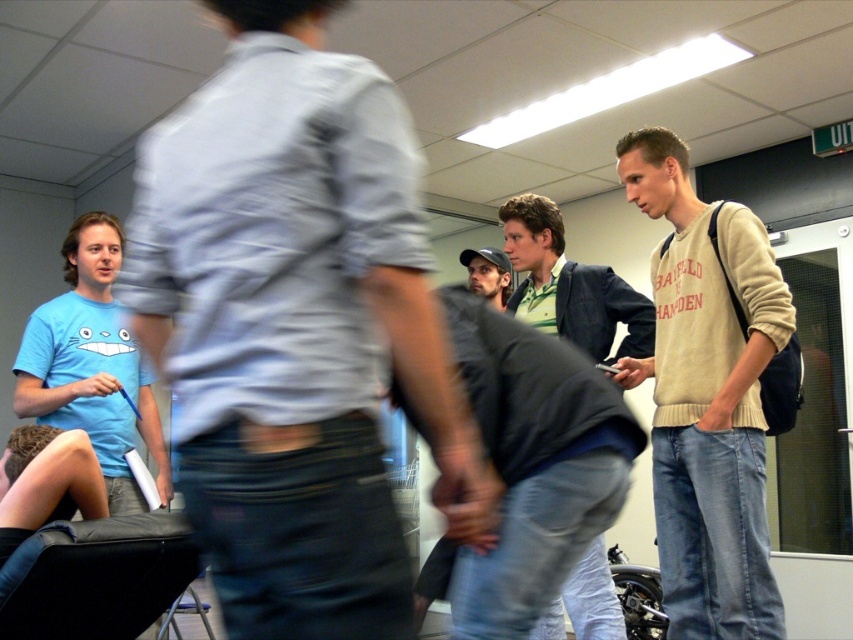
Question: Which of these objects is positioned closest to the beige sweater at right?

Choices:
 (A) green textured shirt at center
 (B) blue matte t-shirt at left
 (C) matte black cap at center

Answer: (A)

Question: Can you confirm if light blue t-shirt at upper left is wider than matte black cap at center?

Choices:
 (A) yes
 (B) no

Answer: (A)

Question: Which of the following is the farthest from the observer?

Choices:
 (A) beige sweater at right
 (B) blue matte t-shirt at left
 (C) light blue t-shirt at upper left

Answer: (B)

Question: Which object appears farthest from the camera in this image?

Choices:
 (A) blue matte t-shirt at left
 (B) matte black cap at center
 (C) light blue t-shirt at upper left

Answer: (B)

Question: Can you confirm if beige sweater at right is positioned above black leather chair at lower left?

Choices:
 (A) yes
 (B) no

Answer: (A)

Question: Does light blue t-shirt at upper left lie behind beige sweater at right?

Choices:
 (A) yes
 (B) no

Answer: (B)